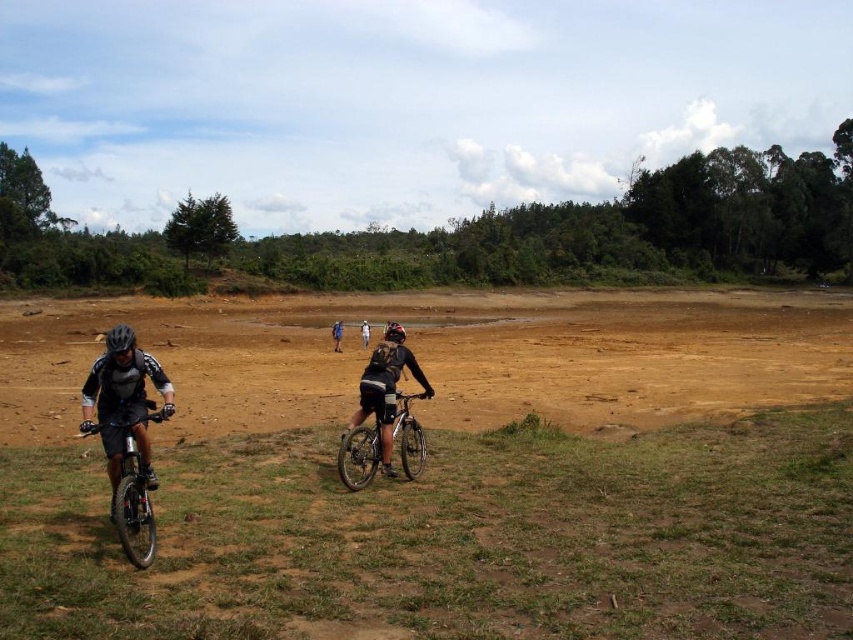
Identify the location of shiny metallic bicycle at lower left. (132, 490).

In the scene shown: Can you confirm if shiny metallic bicycle at lower left is positioned to the left of matte black helmet at center?

Correct, you'll find shiny metallic bicycle at lower left to the left of matte black helmet at center.

Is point (137, 557) behind point (396, 340)?

No.

Identify the location of shiny metallic bicycle at lower left. This screenshot has height=640, width=853. (132, 490).

From the picture: Can you confirm if brown sandy ground at center is taller than matte black helmet at center?

Correct, brown sandy ground at center is much taller as matte black helmet at center.

Does brown sandy ground at center lie in front of matte black helmet at center?

No, brown sandy ground at center is further to the viewer.

Is point (485, 349) positioned in front of point (390, 324)?

No, (485, 349) is further to viewer.

This screenshot has height=640, width=853. In order to click on brown sandy ground at center in this screenshot , I will do `click(440, 356)`.

Can you confirm if silver metallic bicycle at center is thinner than blue fabric shorts at center?

Yes, silver metallic bicycle at center is thinner than blue fabric shorts at center.

Is point (354, 488) positioned after point (337, 340)?

No, it is not.

What are the coordinates of `silver metallic bicycle at center` in the screenshot? It's located at (358, 456).